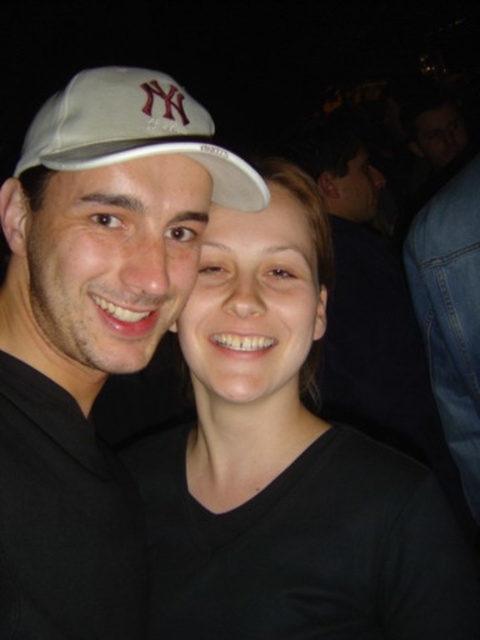
You are a photographer trying to focus on the two main subjects in the image. Which of the two white matte caps, the white matte cap at left or the white matte baseball cap at upper left, is closer to the camera?

The white matte cap at left is closer to the camera because the white matte baseball cap at upper left is behind it.

You are holding a 24 inch wide poster and want to place it on the wall so that it doesn not block the point at point (x=25, y=554). Can you fit the poster without overlapping the point?

The distance between you and point (x=25, y=554) is 26.02 inches. Since the poster is 24 inches wide, it can be placed without overlapping the point as long as it is positioned at least 24 inches away from the point towards you.

You are a photographer trying to adjust the lighting for a photo shoot. You notice the black matte shirt at center and the white matte cap at left in the frame. Which object should you focus on if you want to highlight the larger width in your composition?

The black matte shirt at center has a greater width than the white matte cap at left, so you should focus on the black matte shirt at center to highlight the larger width in your composition.